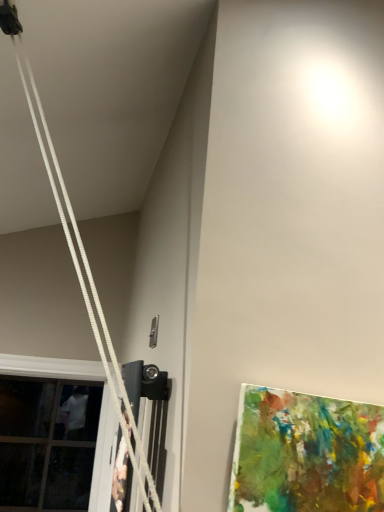
Describe the element at coordinates (306, 453) in the screenshot. The height and width of the screenshot is (512, 384). I see `abstract painting at right` at that location.

Identify the location of abstract painting at right. The height and width of the screenshot is (512, 384). (306, 453).

You are a GUI agent. You are given a task and a screenshot of the screen. Output one action in this format:
    pyautogui.click(x=<x>, y=<y>)
    Task: Click on the abstract painting at right
    This screenshot has height=512, width=384.
    Given the screenshot: What is the action you would take?
    pyautogui.click(x=306, y=453)